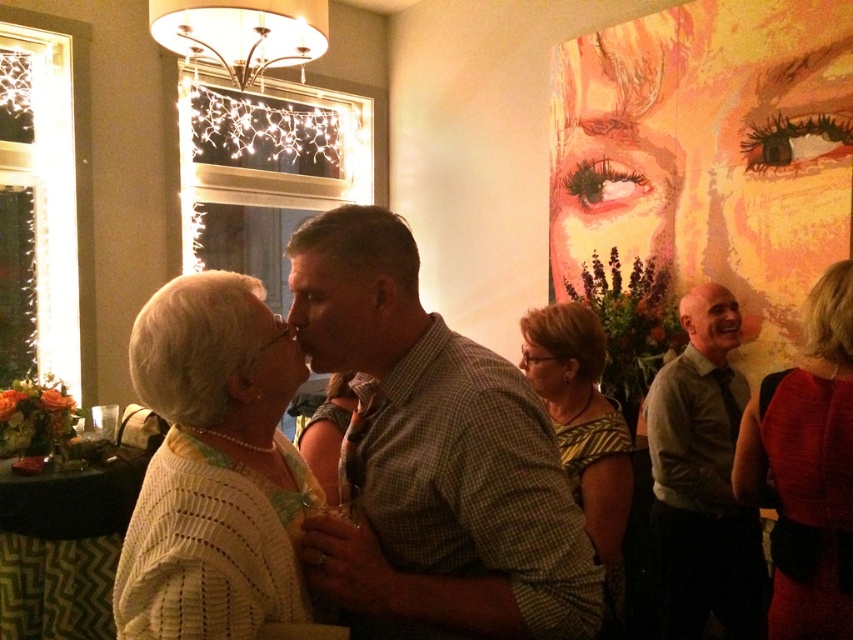
Question: Does white knitted sweater at center appear on the right side of green shirt at right?

Choices:
 (A) no
 (B) yes

Answer: (A)

Question: Can you confirm if white knitted sweater at center is thinner than green shirt at right?

Choices:
 (A) yes
 (B) no

Answer: (A)

Question: Is the position of green shirt at right more distant than that of striped blouse at center?

Choices:
 (A) no
 (B) yes

Answer: (B)

Question: Which point is closer to the camera?

Choices:
 (A) (407, 580)
 (B) (813, 560)
 (C) (271, 573)
 (D) (695, 401)

Answer: (C)

Question: Estimate the real-world distances between objects in this image. Which object is closer to the shiny red dress at right?

Choices:
 (A) white knitted sweater at center
 (B) green checkered shirt at center
 (C) striped blouse at center
 (D) green shirt at right

Answer: (C)

Question: Which point is closer to the camera taking this photo?

Choices:
 (A) (602, 333)
 (B) (735, 573)
 (C) (838, 310)
 (D) (254, 282)

Answer: (D)